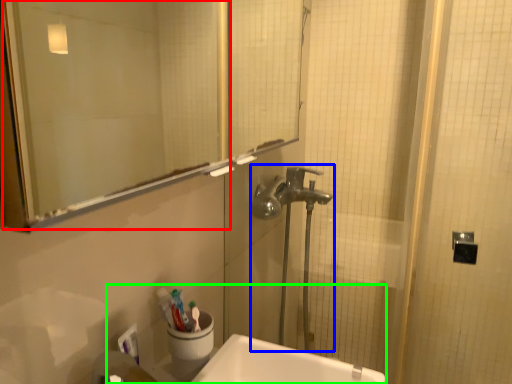
Question: Considering the real-world distances, which object is closest to mirror (highlighted by a red box)? plumbing fixture (highlighted by a blue box) or sink (highlighted by a green box).

Choices:
 (A) plumbing fixture
 (B) sink

Answer: (A)